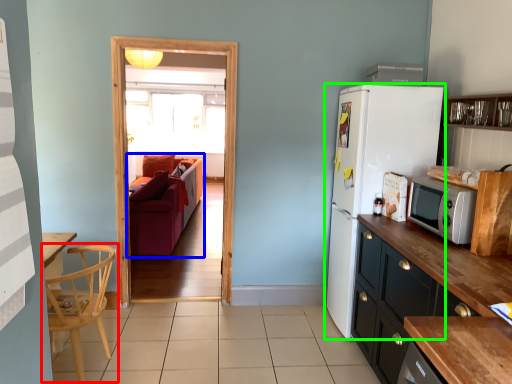
Question: Based on their relative distances, which object is nearer to chair (highlighted by a red box)? Choose from studio couch (highlighted by a blue box) and refrigerator (highlighted by a green box).

Choices:
 (A) studio couch
 (B) refrigerator

Answer: (B)